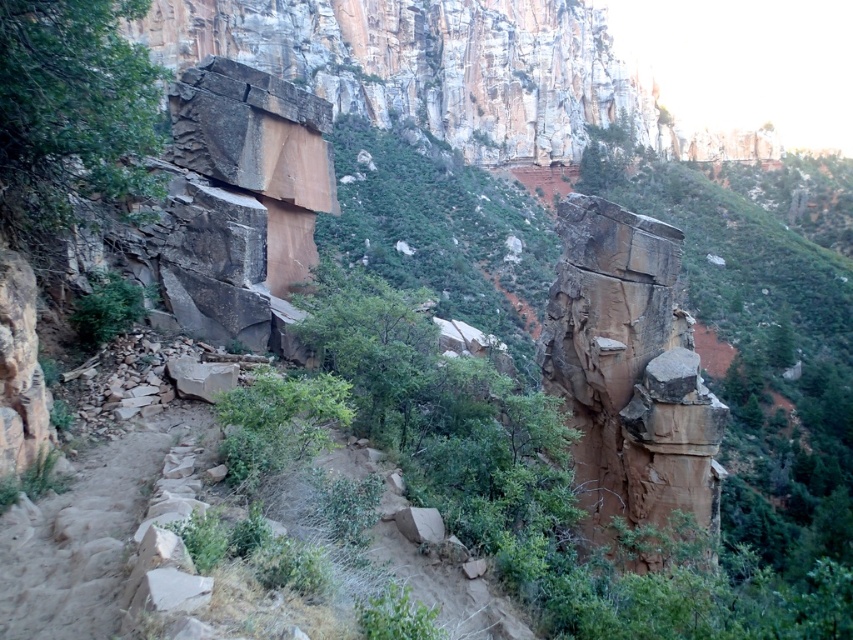
What do you see at coordinates (630, 372) in the screenshot? This screenshot has width=853, height=640. I see `brown rough rock at center` at bounding box center [630, 372].

Consider the image. Who is higher up, brown rough rock at center or green leafy shrub at center-left?

green leafy shrub at center-left

Image resolution: width=853 pixels, height=640 pixels. What are the coordinates of `brown rough rock at center` in the screenshot? It's located at (630, 372).

Identify the location of brown rough rock at center. The image size is (853, 640). (630, 372).